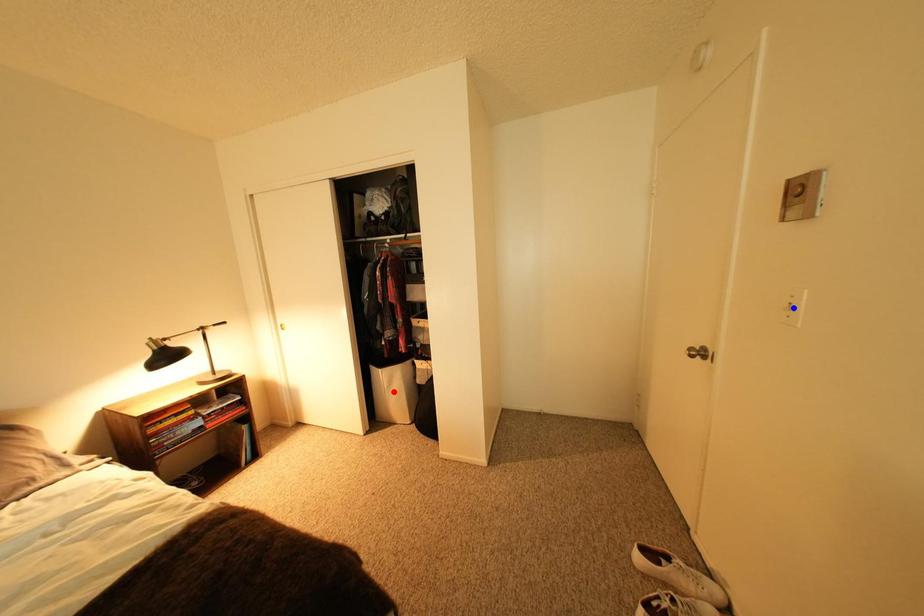
Question: Which of the two points in the image is closer to the camera?

Choices:
 (A) Blue point is closer.
 (B) Red point is closer.

Answer: (A)